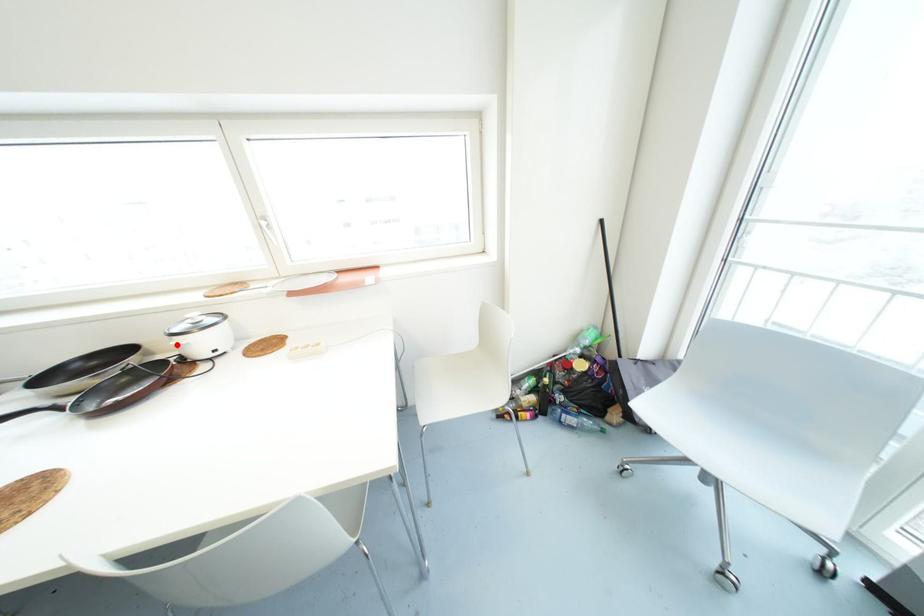
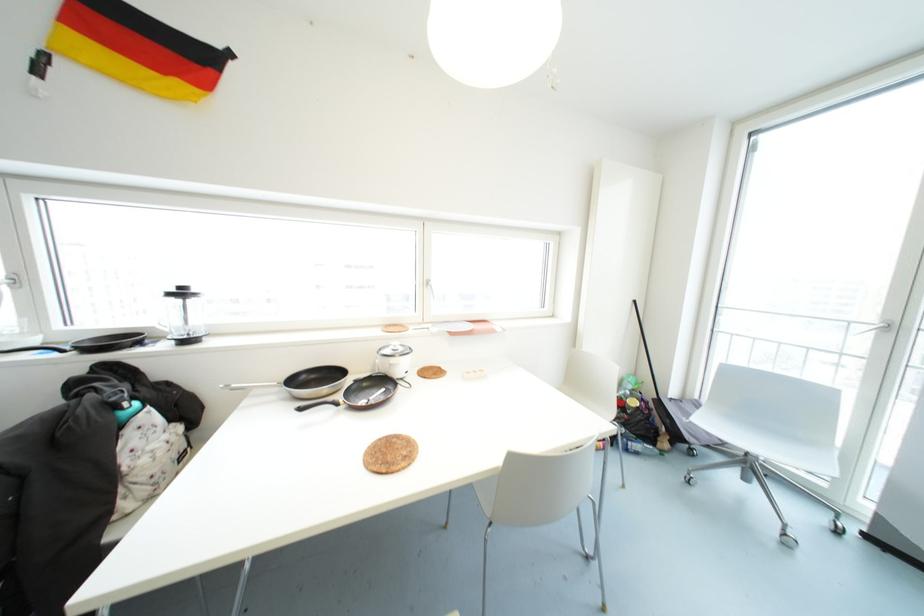
Locate, in the second image, the point that corresponds to the highlighted location in the first image.

(390, 363)